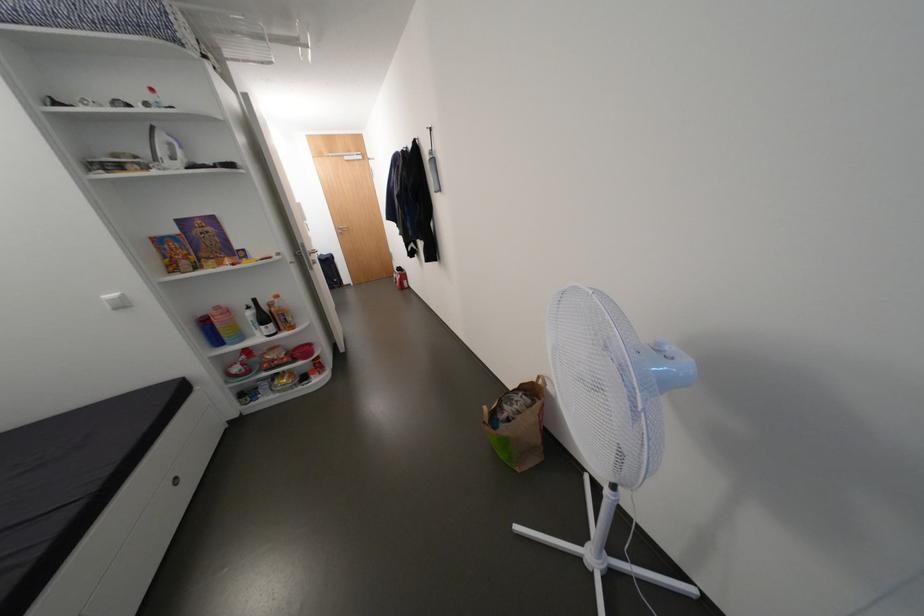
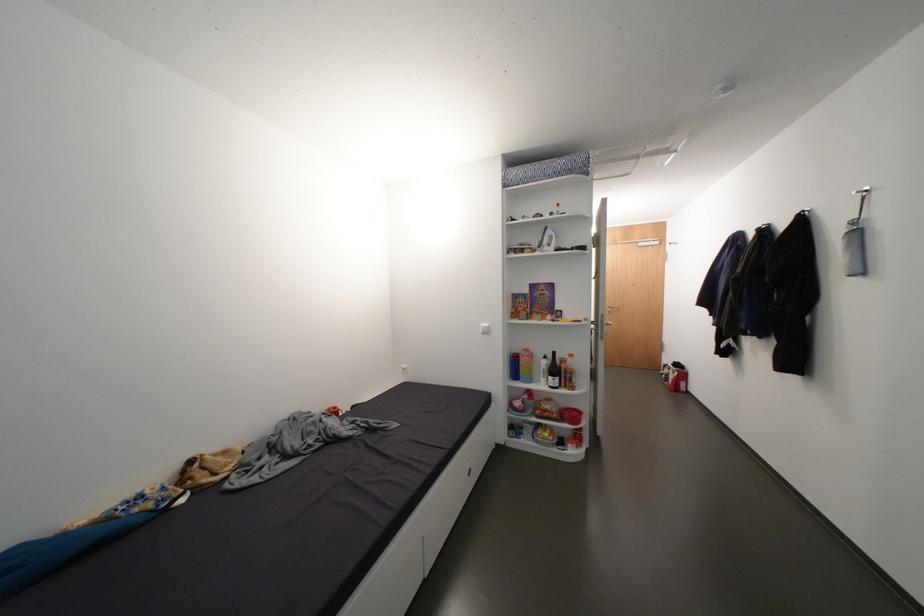
Locate, in the second image, the point that corresponds to (x=348, y=233) in the first image.

(616, 310)